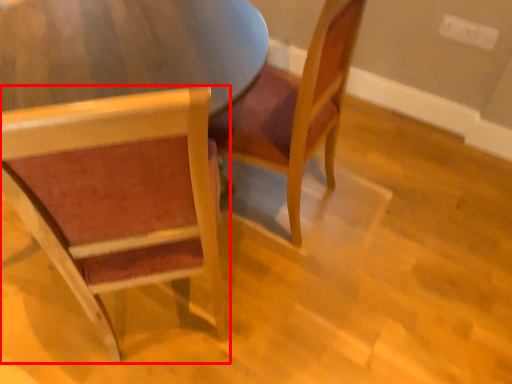
Question: From the image's perspective, where is chair (annotated by the red box) located relative to chair?

Choices:
 (A) below
 (B) above

Answer: (A)